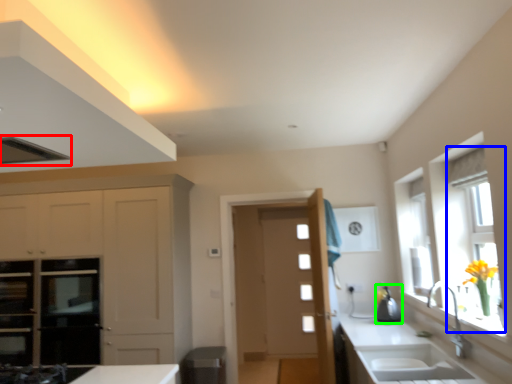
Question: Considering the real-world distances, which object is farthest from exhaust hood (highlighted by a red box)? window (highlighted by a blue box) or appliance (highlighted by a green box)?

Choices:
 (A) window
 (B) appliance

Answer: (B)